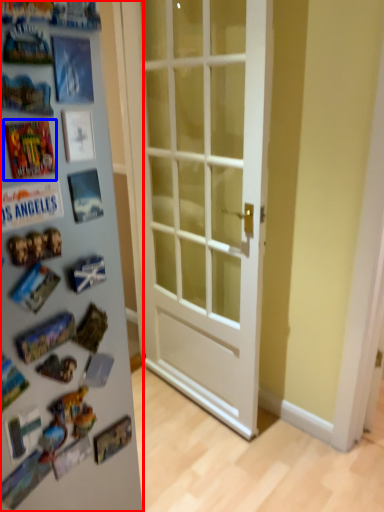
Question: Among these objects, which one is nearest to the camera, fridge (highlighted by a red box) or comic book (highlighted by a blue box)?

Choices:
 (A) fridge
 (B) comic book

Answer: (B)